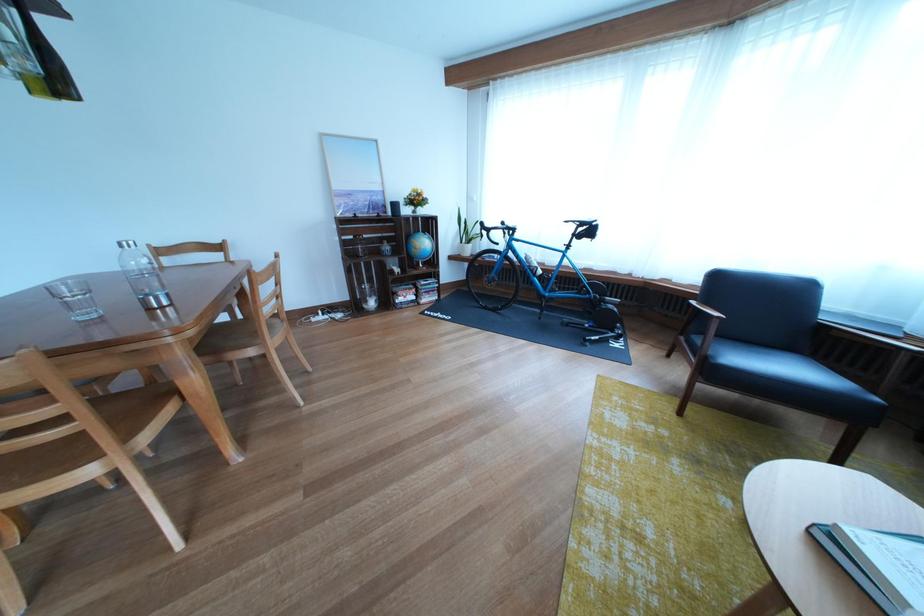
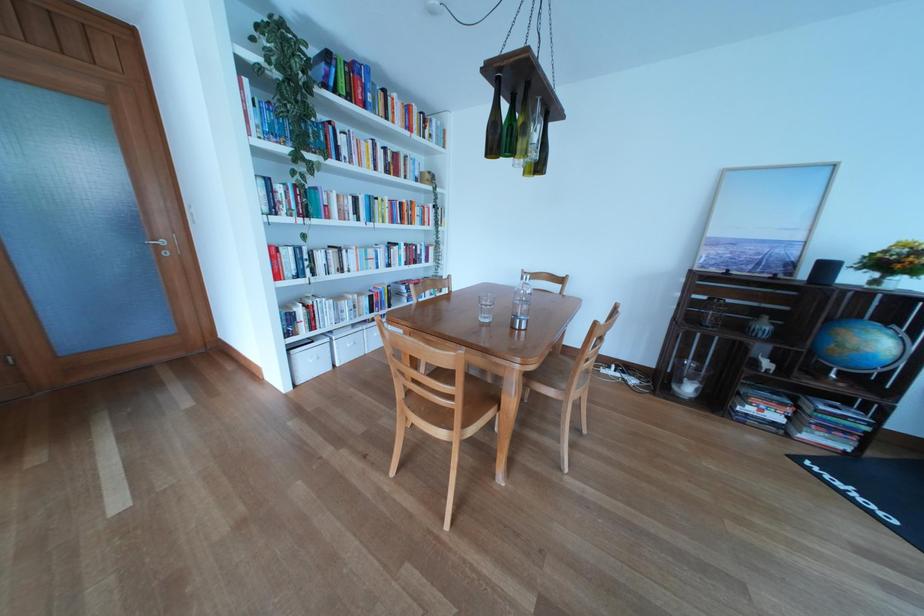
Question: I am providing you with two images of the same scene from different viewpoints. Which of the following objects are not visible in image2?

Choices:
 (A) glass water bottle
 (B) blue globe
 (C) chair sitting surface
 (D) none of these

Answer: (D)